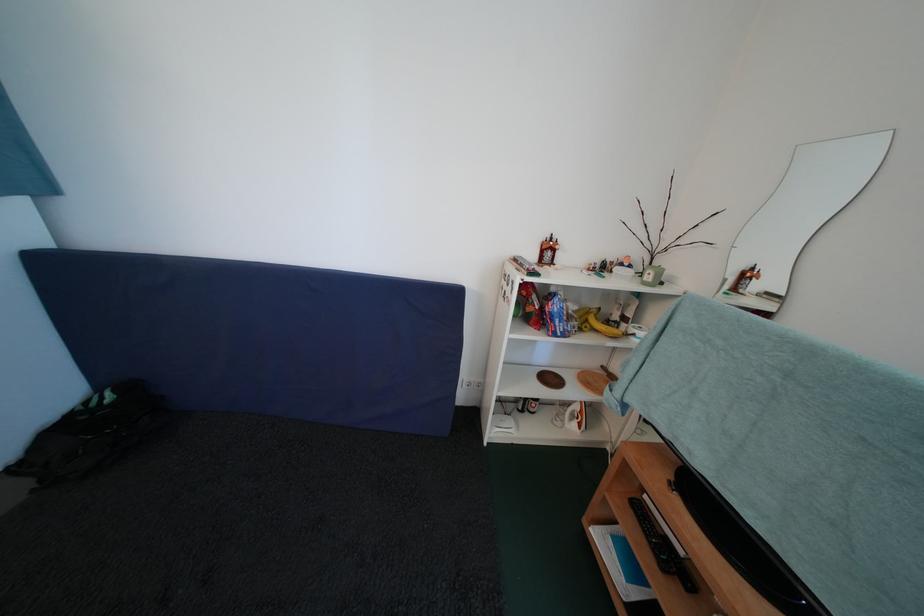
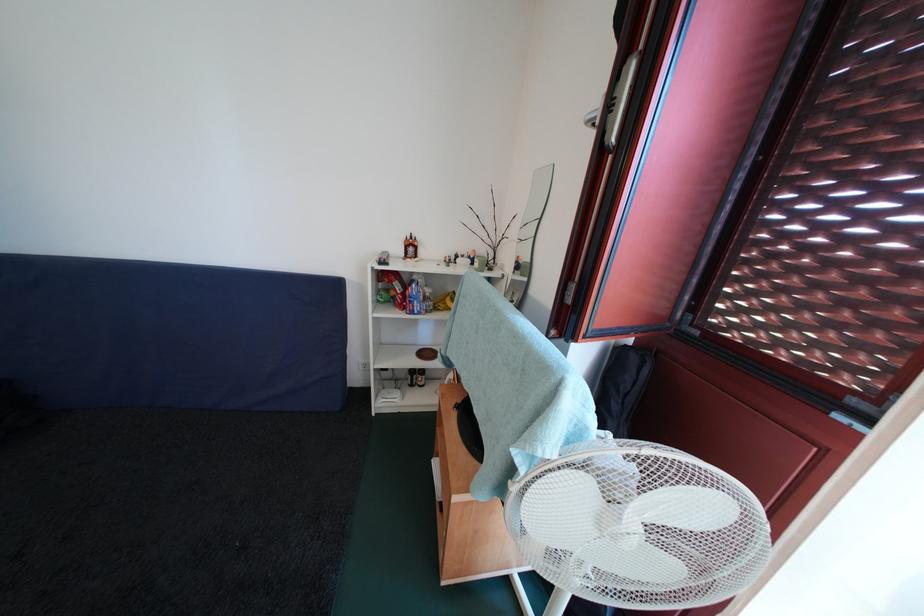
Locate, in the second image, the point that corresponds to [565,326] in the first image.

(422, 307)